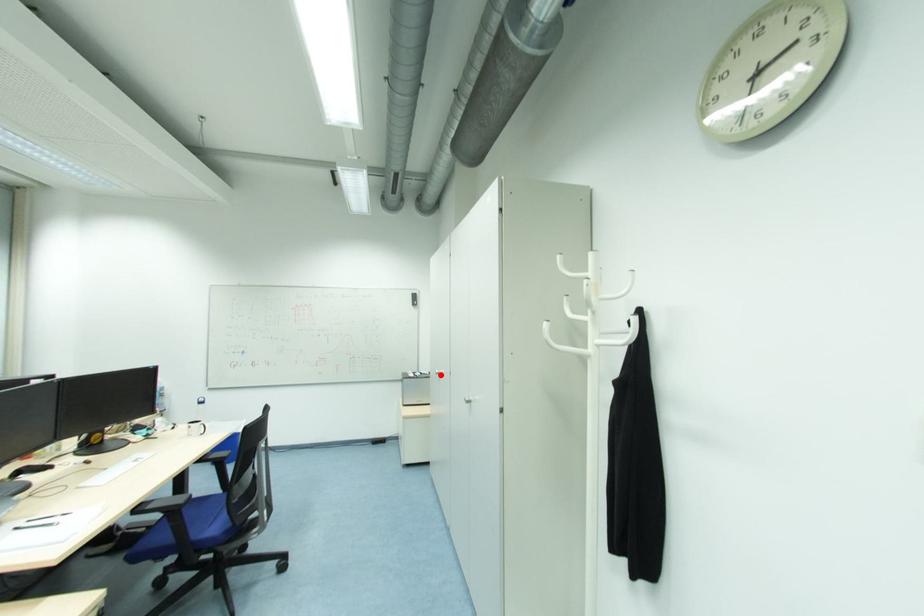
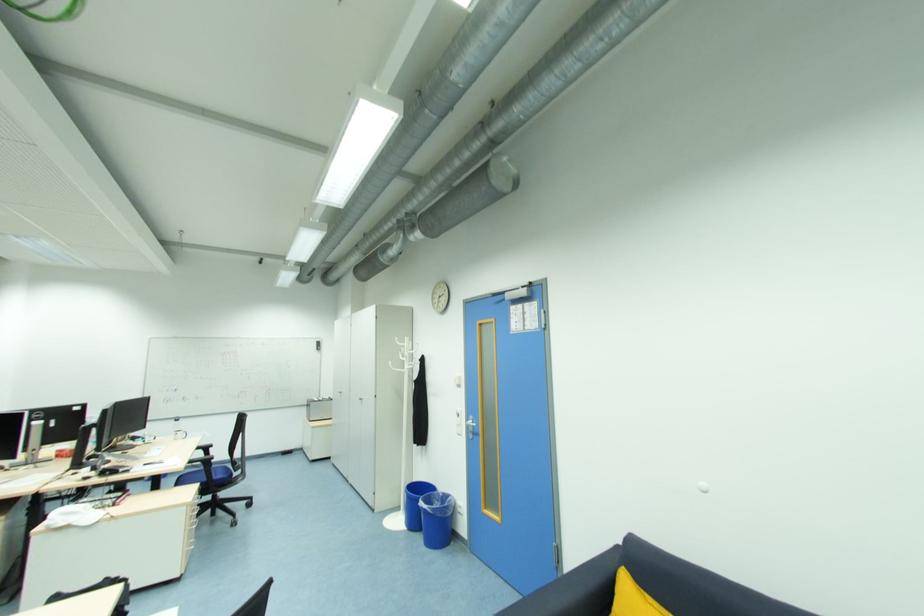
Question: A red point is marked in image1. In image2, is the corresponding 3D point closer to the camera or farther? Reply with the corresponding letter.

Choices:
 (A) The corresponding 3D point is closer.
 (B) The corresponding 3D point is farther.

Answer: (B)